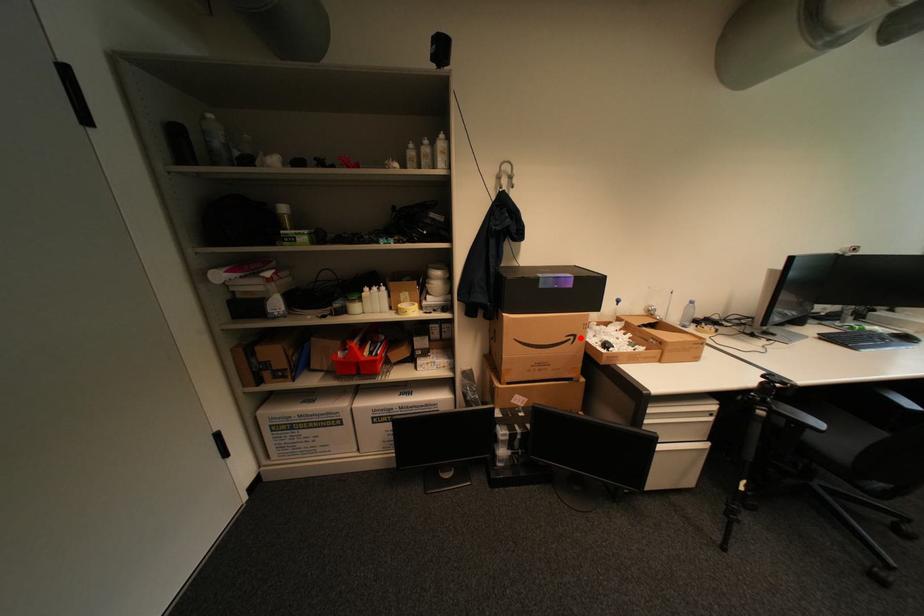
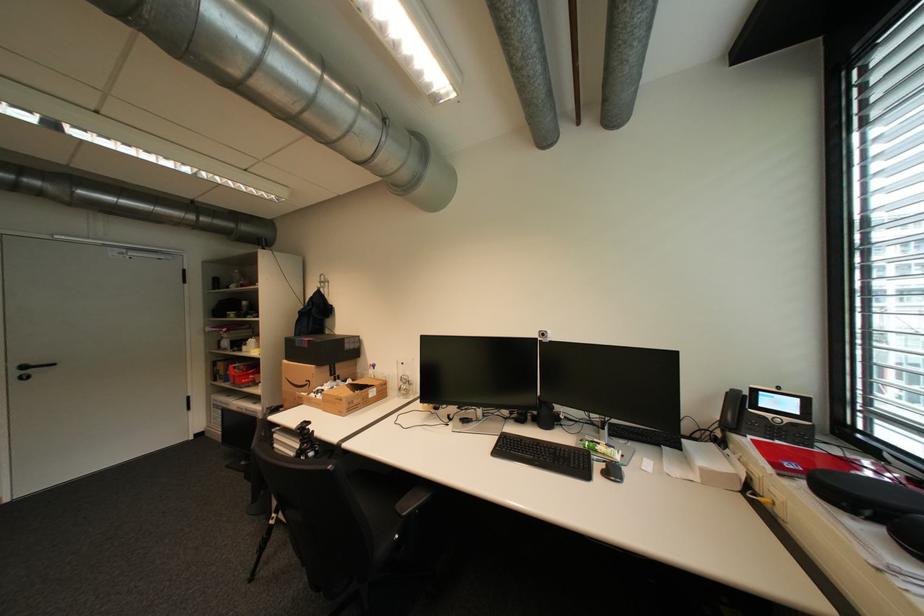
Question: I am providing you with two images of the same scene from different viewpoints. In image1, a red point is highlighted. Considering the same 3D point in image2, which of the following is correct?

Choices:
 (A) It is closer
 (B) It is farther

Answer: (B)